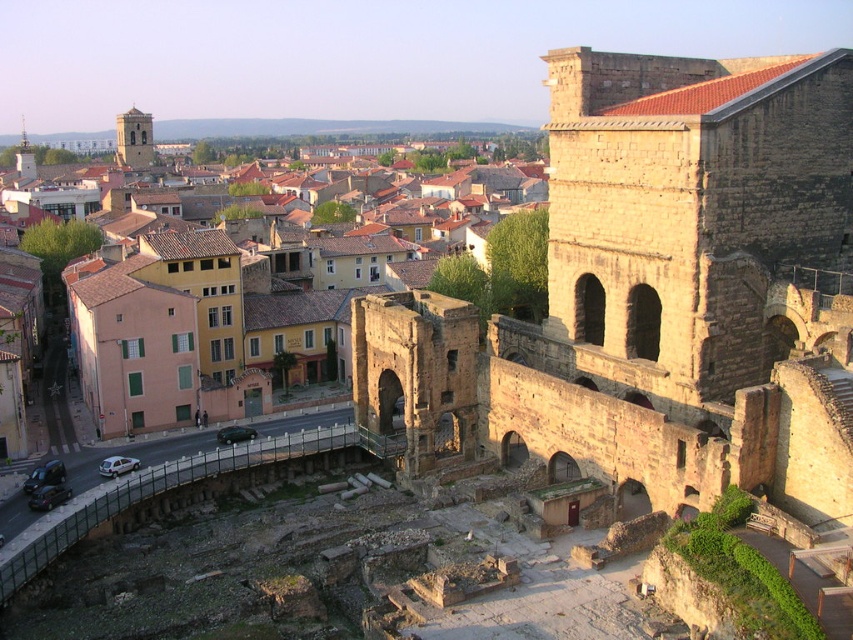
Question: Is yellow stucco buildings at center positioned behind brown stone tower at upper left?

Choices:
 (A) yes
 (B) no

Answer: (B)

Question: Which point appears farthest from the camera in this image?

Choices:
 (A) (445, 301)
 (B) (161, 292)

Answer: (B)

Question: Which object is the closest to the brown stone tower at upper left?

Choices:
 (A) yellow stucco buildings at center
 (B) brown stone ruins at upper right

Answer: (A)

Question: Observing the image, what is the correct spatial positioning of yellow stucco buildings at center in reference to brown stone tower at upper left?

Choices:
 (A) below
 (B) above

Answer: (A)

Question: Among these objects, which one is farthest from the camera?

Choices:
 (A) brown stone ruins at upper right
 (B) yellow stucco buildings at center
 (C) brown stone tower at upper left

Answer: (C)

Question: Does yellow stucco buildings at center have a larger size compared to brown stone tower at upper left?

Choices:
 (A) yes
 (B) no

Answer: (A)